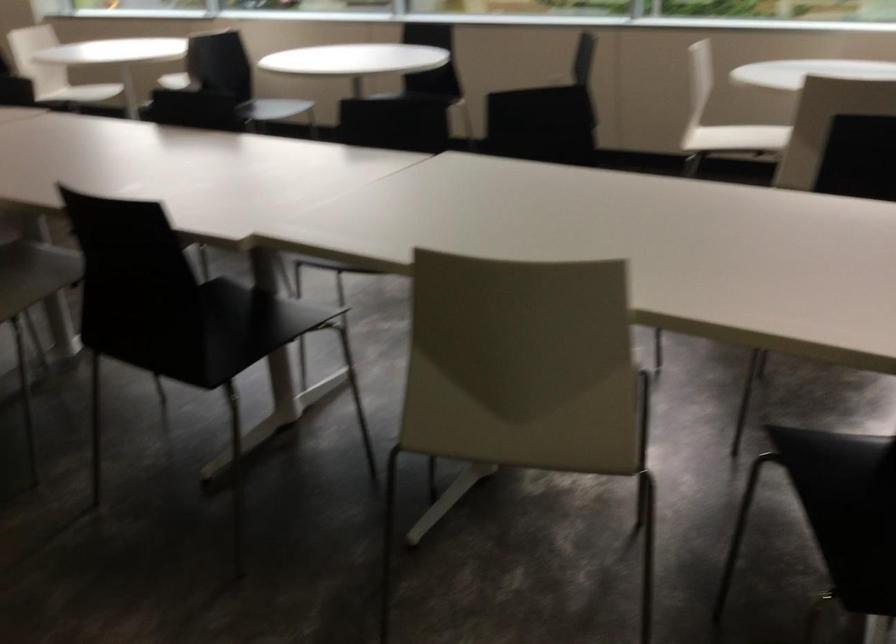
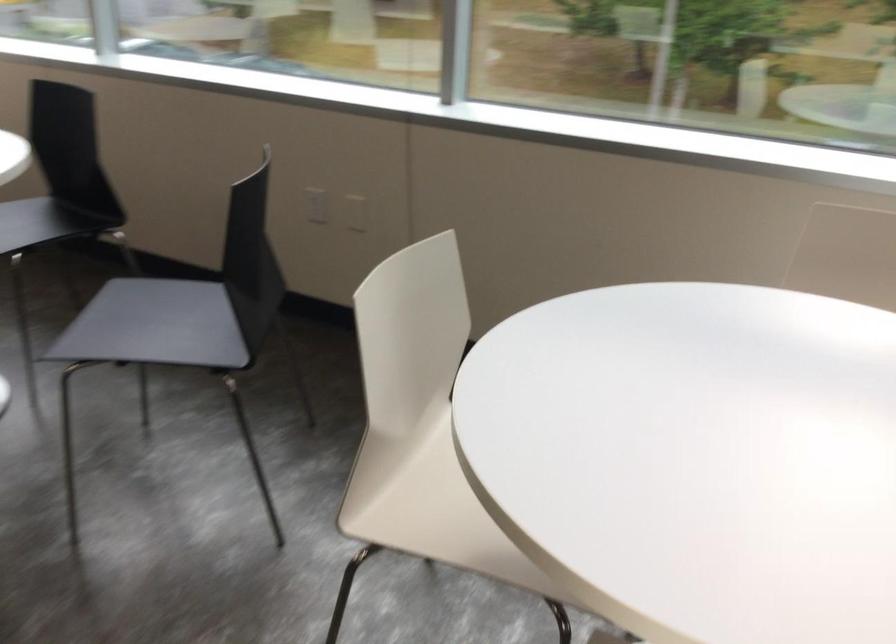
Locate, in the second image, the point that corresponds to (x=731, y=138) in the first image.

(431, 509)